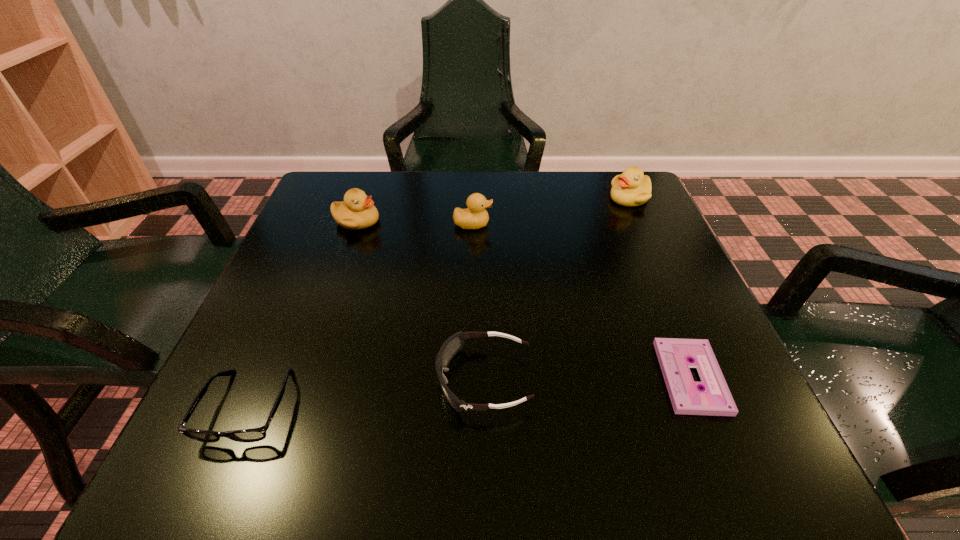
Locate an element on the screen. Image resolution: width=960 pixels, height=540 pixels. videotape that is at the right edge is located at coordinates click(x=674, y=355).

This screenshot has height=540, width=960. In order to click on object that is positioned at the far left corner in this screenshot , I will do `click(357, 211)`.

This screenshot has width=960, height=540. Identify the location of object at the near left corner. (255, 434).

Image resolution: width=960 pixels, height=540 pixels. Find the location of `object at the far right corner`. object at the far right corner is located at coordinates (632, 188).

In the image, there is a desktop. Where is `vacant region at the far edge`? The height and width of the screenshot is (540, 960). vacant region at the far edge is located at coordinates (405, 179).

At what (x,y) coordinates should I click in order to perform the action: click on free region at the near edge of the desktop. Please return your answer as a coordinate pair (x, y). The width and height of the screenshot is (960, 540). Looking at the image, I should click on (353, 472).

Locate an element on the screen. The image size is (960, 540). free spot at the left edge of the desktop is located at coordinates (305, 322).

Where is `vacant space at the right edge`? vacant space at the right edge is located at coordinates (608, 260).

This screenshot has height=540, width=960. In the image, there is a desktop. In order to click on vacant area at the far left corner in this screenshot , I will do `click(330, 207)`.

The image size is (960, 540). In the image, there is a desktop. Identify the location of free space at the near left corner. (202, 419).